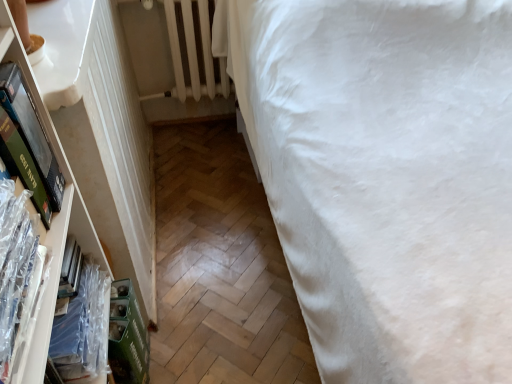
Question: From a real-world perspective, is green matte book at left positioned above or below clear plastic book at left, the 1th book viewed from the front?

Choices:
 (A) above
 (B) below

Answer: (A)

Question: Relative to clear plastic book at left, the 1th book viewed from the front, is green matte book at left in front or behind?

Choices:
 (A) behind
 (B) front

Answer: (A)

Question: Which of these objects is positioned farthest from the clear plastic book at left, the 1th book viewed from the front?

Choices:
 (A) white cotton bed at right
 (B) green matte book at left
 (C) white painted metal radiator at upper left
 (D) clear plastic book at left, which is the 2th book in front-to-back order

Answer: (C)

Question: Which is farther from the white painted metal radiator at upper left?

Choices:
 (A) clear plastic book at left, arranged as the second book when viewed from the back
 (B) clear plastic book at left, which ranks as the 1th book in back-to-front order
 (C) green matte book at left
 (D) white cotton bed at right

Answer: (A)